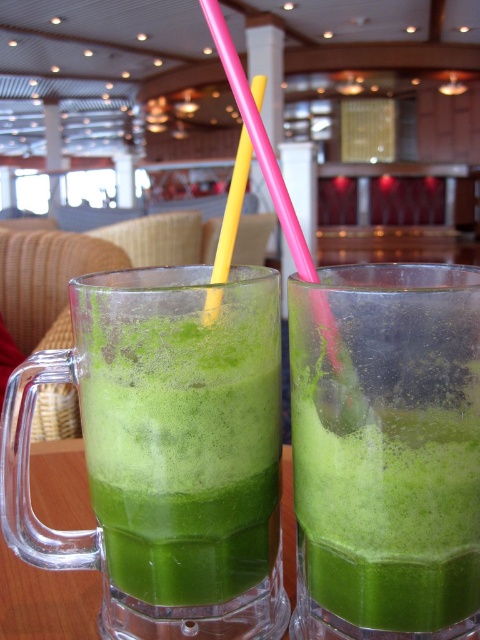
You are a customer at a cafe and want to drink from the green frosted glass mug at left and the yellow plastic straw at center. Which object is closer to you so you can reach it first?

The green frosted glass mug at left is closer to you than the yellow plastic straw at center, so you can reach it first.

You are a customer at a cafe and want to know if the yellow plastic straw at center can fit into the green frothy smoothie at center without bending. Can you determine this based on their sizes?

The green frothy smoothie at center might be wider than yellow plastic straw at center, so the straw should fit without bending as the smoothie is wider.